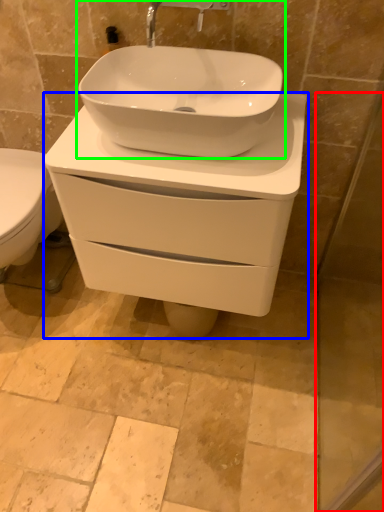
Question: Which object is positioned farthest from screen door (highlighted by a red box)? Select from porcelain (highlighted by a blue box) and sink (highlighted by a green box).

Choices:
 (A) porcelain
 (B) sink

Answer: (B)